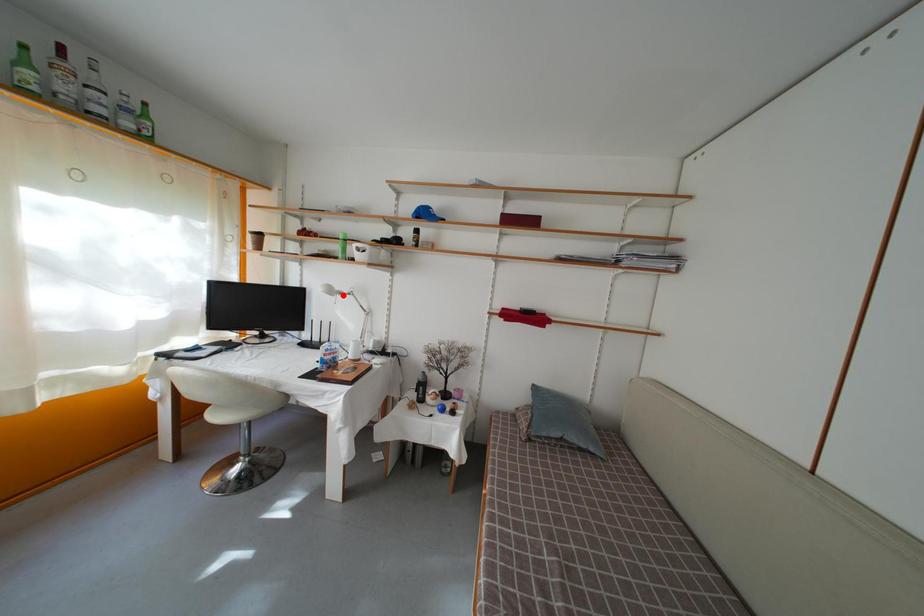
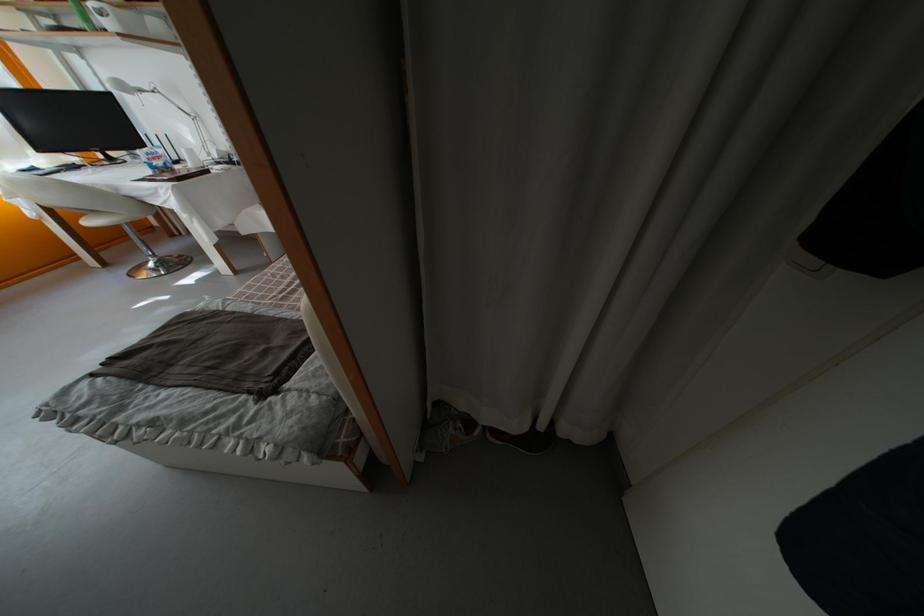
Question: I am providing you with two images of the same scene from different viewpoints. In image1, a red point is highlighted. Considering the same 3D point in image2, which of the following is correct?

Choices:
 (A) It is closer
 (B) It is farther

Answer: (B)